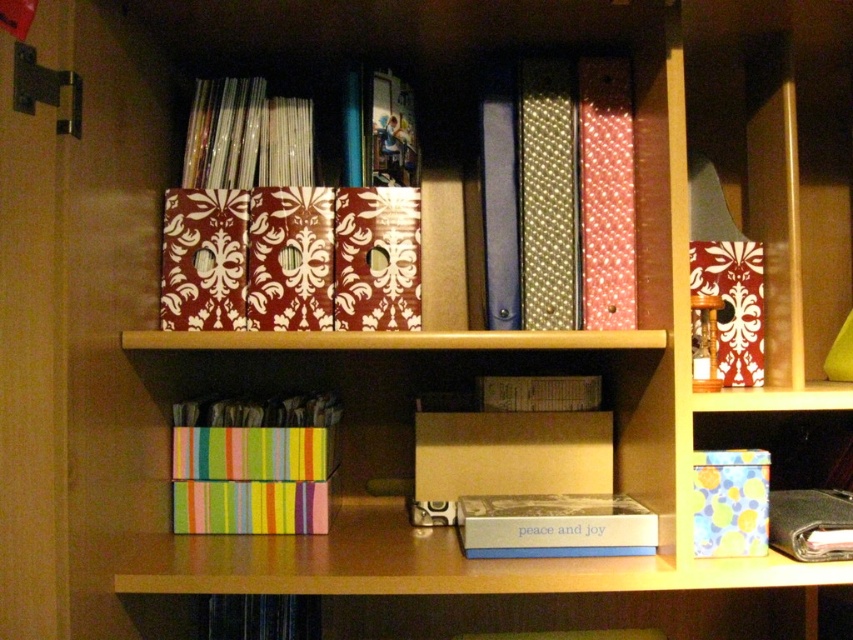
Between point (506, 456) and point (757, 310), which one is positioned behind?

The point (506, 456) is behind.

Locate an element on the screen. matte white box at center is located at coordinates (508, 458).

You are a GUI agent. You are given a task and a screenshot of the screen. Output one action in this format:
    pyautogui.click(x=<x>, y=<y>)
    Task: Click on the matte white box at center
    
    Given the screenshot: What is the action you would take?
    pyautogui.click(x=508, y=458)

The image size is (853, 640). In order to click on matte white box at center in this screenshot , I will do `click(508, 458)`.

Find the location of a particular element. The height and width of the screenshot is (640, 853). polka dot fabric tie at center is located at coordinates coord(576,195).

Locate an element on the screen. polka dot fabric tie at center is located at coordinates (576, 195).

Is blue matte book at center to the right of patterned cardboard box at center from the viewer's perspective?

In fact, blue matte book at center is to the left of patterned cardboard box at center.

Who is positioned more to the left, blue matte book at center or patterned cardboard box at center?

blue matte book at center

This screenshot has height=640, width=853. What do you see at coordinates (554, 525) in the screenshot?
I see `blue matte book at center` at bounding box center [554, 525].

This screenshot has width=853, height=640. What are the coordinates of `blue matte book at center` in the screenshot? It's located at (554, 525).